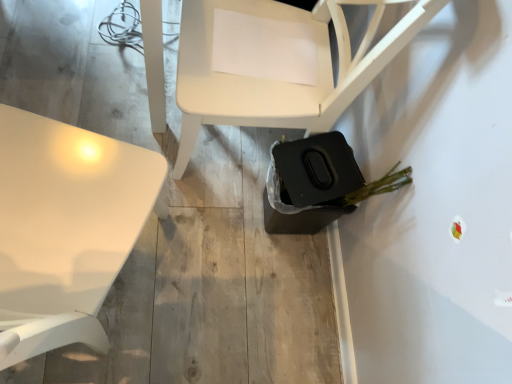
Question: Is white glossy table at upper left taller than matte white chair at center?

Choices:
 (A) yes
 (B) no

Answer: (A)

Question: Is white glossy table at upper left facing towards matte white chair at center?

Choices:
 (A) yes
 (B) no

Answer: (B)

Question: Considering the relative sizes of white glossy table at upper left and matte white chair at center in the image provided, is white glossy table at upper left bigger than matte white chair at center?

Choices:
 (A) no
 (B) yes

Answer: (B)

Question: Does white glossy table at upper left appear on the right side of matte white chair at center?

Choices:
 (A) yes
 (B) no

Answer: (B)

Question: Is white glossy table at upper left located outside matte white chair at center?

Choices:
 (A) yes
 (B) no

Answer: (A)

Question: From a real-world perspective, is white glossy table at upper left on top of matte white chair at center?

Choices:
 (A) yes
 (B) no

Answer: (A)

Question: From a real-world perspective, is matte white chair at center physically above white glossy table at upper left?

Choices:
 (A) no
 (B) yes

Answer: (A)

Question: From the image's perspective, is matte white chair at center beneath white glossy table at upper left?

Choices:
 (A) no
 (B) yes

Answer: (A)

Question: Considering the relative sizes of matte white chair at center and white glossy table at upper left in the image provided, is matte white chair at center smaller than white glossy table at upper left?

Choices:
 (A) yes
 (B) no

Answer: (A)

Question: Is matte white chair at center to the left of white glossy table at upper left from the viewer's perspective?

Choices:
 (A) no
 (B) yes

Answer: (A)

Question: Is matte white chair at center thinner than white glossy table at upper left?

Choices:
 (A) yes
 (B) no

Answer: (A)

Question: From the image's perspective, would you say matte white chair at center is positioned over white glossy table at upper left?

Choices:
 (A) yes
 (B) no

Answer: (A)

Question: Would you say white glossy table at upper left is to the left or to the right of matte white chair at center in the picture?

Choices:
 (A) right
 (B) left

Answer: (B)